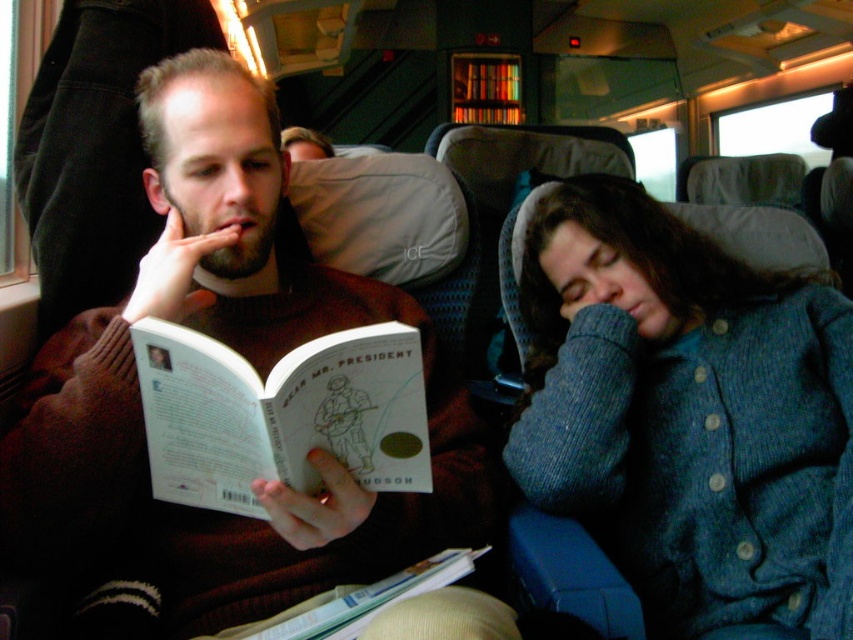
You are a passenger on the train and want to move from the seat near point (248, 184) to the exit door located near point (311, 618). Is there a clear path between these two points?

Point (248, 184) is behind point (311, 618), so there is a clear path between them.

You are a photographer trying to capture a closeup of the knitted blue sweater at right. The camera you are using has a minimum focusing distance of 35 inches. Can you take the photo without moving the sweater?

The knitted blue sweater at right is 34.26 inches from camera, which is within the camera minimum focusing distance of 35 inches. Therefore, you can take the photo without moving the sweater.

You are a passenger on the train and want to place a small bag on the seat between the brown sweater at left and the hardcover book at center. Is there enough space between them for the bag?

The brown sweater at left is located above the hardcover book at center, so there is vertical space between them. However, since the bag needs to be placed on the seat horizontally, the vertical positioning does not affect the horizontal space. You should check the horizontal distance between the two objects to determine if the bag fits.